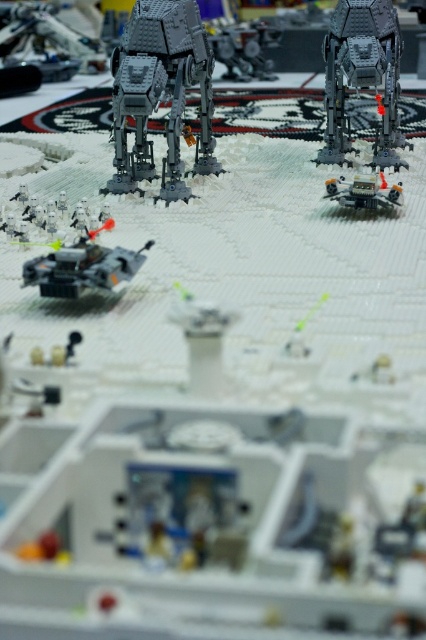
At what (x,y) coordinates should I click in order to perform the action: click on dark gray plastic walker at upper left. Please return your answer as a coordinate pair (x, y). The width and height of the screenshot is (426, 640). Looking at the image, I should click on (161, 93).

Is point (181, 42) closer to viewer compared to point (3, 220)?

No, (181, 42) is further to viewer.

Find the location of a particular element. Image resolution: width=426 pixels, height=640 pixels. dark gray plastic walker at upper left is located at coordinates (161, 93).

Which is in front, point (203, 92) or point (109, 220)?

Point (109, 220) is in front.

Does dark gray plastic walker at upper left have a smaller size compared to matte black tank at lower left?

No, dark gray plastic walker at upper left is not smaller than matte black tank at lower left.

Measure the distance between point [172,54] and camera.

The distance of point [172,54] from camera is 4.41 feet.

I want to click on dark gray plastic walker at upper left, so click(x=161, y=93).

Can you confirm if matte black at-at walker at upper left is positioned above metallic silver at-at walker at center?

Actually, matte black at-at walker at upper left is below metallic silver at-at walker at center.

Who is taller, matte black at-at walker at upper left or metallic silver at-at walker at center?

Standing taller between the two is matte black at-at walker at upper left.

Which is behind, point (49, 80) or point (261, 29)?

Point (261, 29)

Find the location of a particular element. matte black at-at walker at upper left is located at coordinates (46, 40).